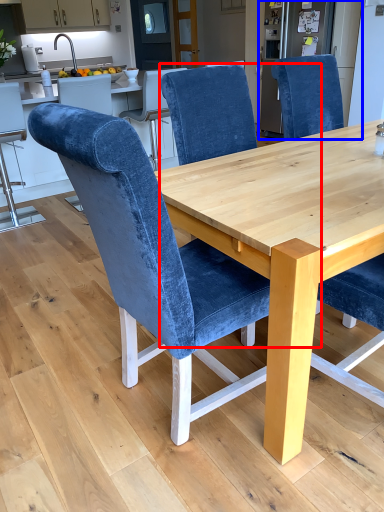
Question: Among these objects, which one is farthest to the camera, chair (highlighted by a red box) or appliance (highlighted by a blue box)?

Choices:
 (A) chair
 (B) appliance

Answer: (B)